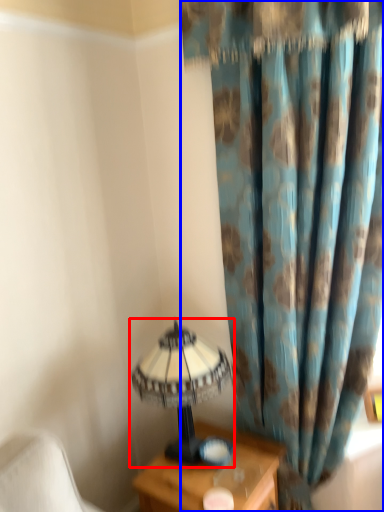
Question: Which of the following is the closest to the observer, lamp (highlighted by a red box) or curtain (highlighted by a blue box)?

Choices:
 (A) lamp
 (B) curtain

Answer: (B)